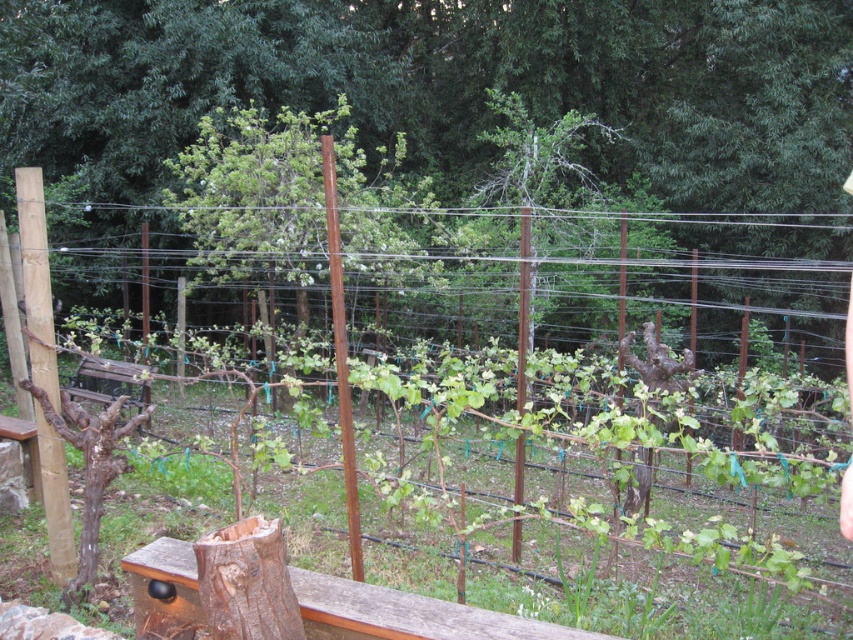
Question: Which object appears closest to the camera in this image?

Choices:
 (A) brown wood tree at center
 (B) rusty wire fence at center

Answer: (B)

Question: Is brown wood tree at center to the left of rusty wire fence at center from the viewer's perspective?

Choices:
 (A) no
 (B) yes

Answer: (B)

Question: Is brown wood tree at center positioned before rusty wire fence at center?

Choices:
 (A) yes
 (B) no

Answer: (B)

Question: Is brown wood tree at center wider than rusty wire fence at center?

Choices:
 (A) yes
 (B) no

Answer: (A)